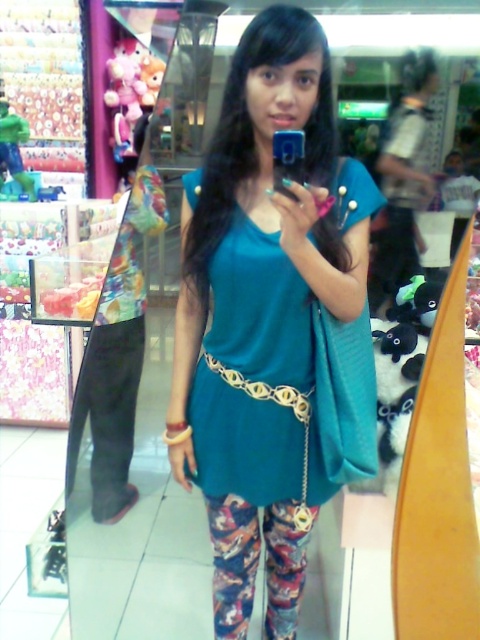
Is teal fabric dress at center thinner than teal fabric shirt at center?

Yes, teal fabric dress at center is thinner than teal fabric shirt at center.

In the scene shown: Does teal fabric dress at center have a smaller size compared to teal fabric shirt at center?

Yes.

Image resolution: width=480 pixels, height=640 pixels. Identify the location of teal fabric dress at center. (263, 314).